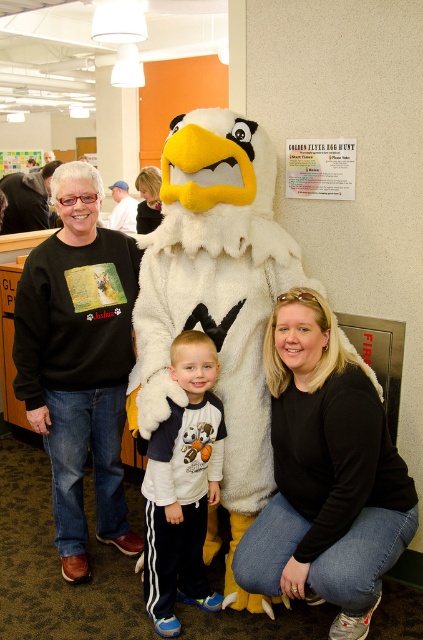
You are a photographer trying to position the white plush eagle at center in the center of the frame. The camera shows a grid with a central point marked at coordinates point (216, 296). Is the white plush eagle at center already positioned correctly?

The white plush eagle at center is represented by point (216, 296), so yes, it is already centered at the central point marked on the camera grid.

You are a photographer trying to arrange the group for a better photo. You notice the white fleece sweatshirt at center and the matte black shirt at upper left. Which one should you move to the right to create symmetry?

The matte black shirt at upper left should be moved to the right to align with the white fleece sweatshirt at center, as the white fleece sweatshirt at center is already on the right side of the matte black shirt at upper left.

You are standing at the position of the eagle mascot in the center of the group. You want to hand a flyer to the person who is closer to you. Which point should you aim for, point A at location point (x=337, y=508) or point B at location point (x=153, y=195)?

Point A at location point (x=337, y=508) is closer to the eagle mascot because it is in front of point B at location point (x=153, y=195).